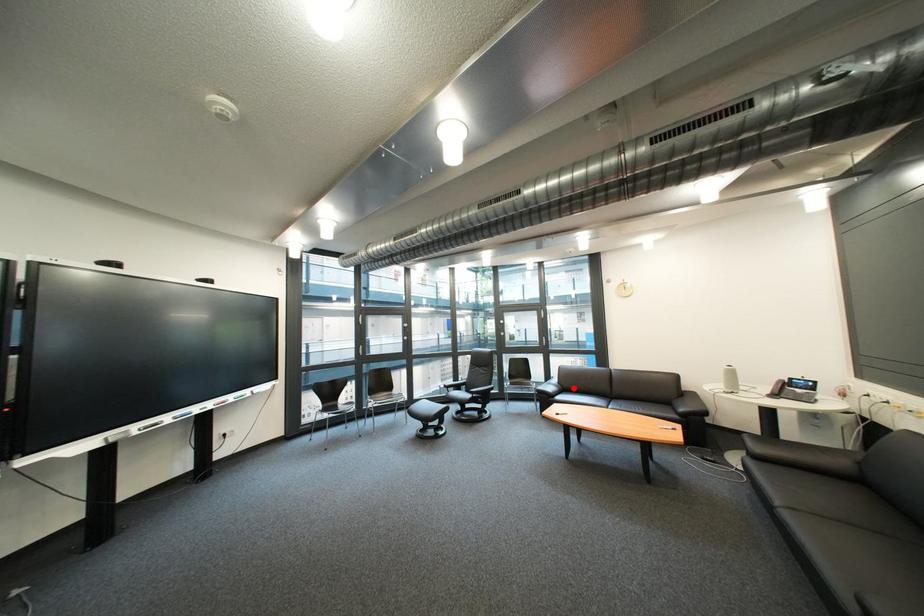
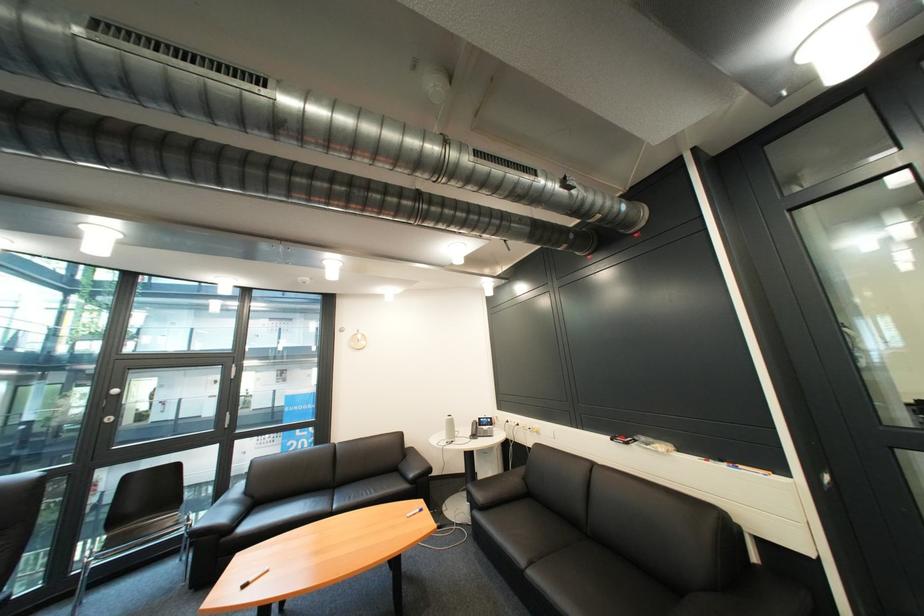
Find the pixel in the second image that matches the highlighted location in the first image.

(262, 503)